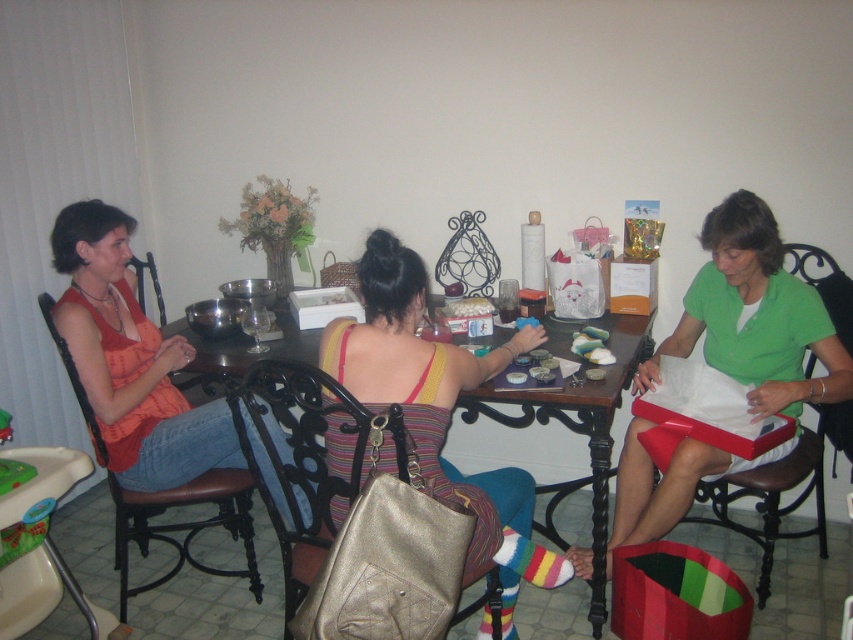
You are a person who is 70 inches tall. You want to sit on the black leather chair at right while keeping your striped fabric dress at center from getting dirty. Can you sit down without the dress touching the chair?

The striped fabric dress at center is 33.03 inches away from the black leather chair at right. Since the distance between them is greater than the typical arm length of a person, you can sit on the black leather chair at right without the dress touching the chair.

You are sitting at the table and want to grab the metallic gold handbag at center to put your keys in it. However, there is a brown leather chair at left in the way. Can you reach the handbag without moving the chair?

The metallic gold handbag at center is closer to the viewer than the brown leather chair at left, so you can reach the metallic gold handbag at center without needing to move the brown leather chair at left because it is farther away.